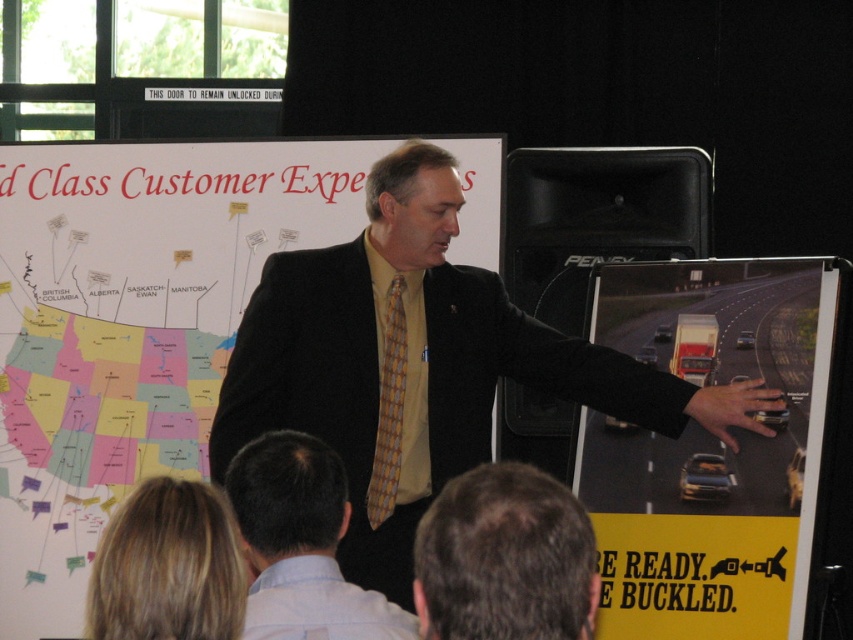
Question: Which object is positioned closest to the white paperboard at upper left?

Choices:
 (A) yellow tie at center
 (B) yellow paper at center
 (C) light blue cotton dress shirt at lower left
 (D) matte black suit at center

Answer: (D)

Question: Estimate the real-world distances between objects in this image. Which object is farther from the yellowplaid fabrictie at center?

Choices:
 (A) yellow paper at center
 (B) white paperboard at upper left
 (C) matte black suit at center

Answer: (B)

Question: In this image, where is matte black suit at center located relative to dark brown hair at lower center?

Choices:
 (A) above
 (B) below

Answer: (A)

Question: Among these points, which one is nearest to the camera?

Choices:
 (A) (45, 228)
 (B) (570, 545)
 (C) (398, 388)

Answer: (B)

Question: Where is dark brown hair at lower center located in relation to yellowplaid fabrictie at center in the image?

Choices:
 (A) below
 (B) above

Answer: (A)

Question: Does yellow tie at center appear under light blue cotton dress shirt at lower left?

Choices:
 (A) yes
 (B) no

Answer: (B)